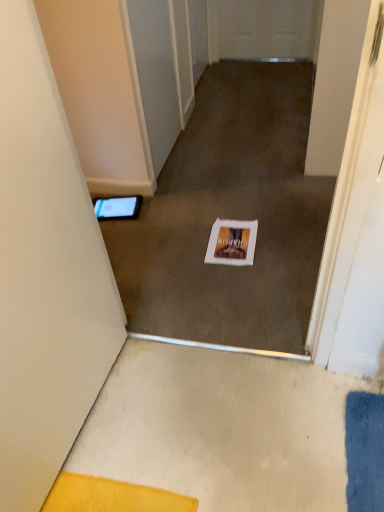
What do you see at coordinates (117, 207) in the screenshot? I see `black glossy tablet at left` at bounding box center [117, 207].

Find the location of a particular element. white paper at center is located at coordinates [232, 242].

Between white matte door at left and white paper at center, which one has less height?

With less height is white paper at center.

Which is more to the left, white matte door at left or white paper at center?

Positioned to the left is white matte door at left.

From a real-world perspective, who is located lower, white matte door at left or white paper at center?

white paper at center is physically lower.

Is white paper at center smaller than black glossy tablet at left?

Yes, white paper at center is smaller than black glossy tablet at left.

Does white paper at center contain black glossy tablet at left?

That's incorrect, black glossy tablet at left is not inside white paper at center.

Does white paper at center turn towards black glossy tablet at left?

No, white paper at center is not turned towards black glossy tablet at left.

Is white paper at center closer to the viewer compared to black glossy tablet at left?

Yes, the depth of white paper at center is less than that of black glossy tablet at left.

From the image's perspective, is black glossy tablet at left over white paper at center?

Correct, black glossy tablet at left appears higher than white paper at center in the image.

Which is in front, black glossy tablet at left or white paper at center?

white paper at center is in front.

In terms of height, does black glossy tablet at left look taller or shorter compared to white paper at center?

black glossy tablet at left is taller than white paper at center.

Which of these two, white matte door at left or black glossy tablet at left, is wider?

With larger width is black glossy tablet at left.

Consider the image. Between white matte door at left and black glossy tablet at left, which one appears on the right side from the viewer's perspective?

Positioned to the right is white matte door at left.

Considering the positions of objects white matte door at left and black glossy tablet at left in the image provided, who is behind, white matte door at left or black glossy tablet at left?

Positioned behind is black glossy tablet at left.

Where is `door below the black glossy tablet at left (from the image's perspective)`? This screenshot has height=512, width=384. door below the black glossy tablet at left (from the image's perspective) is located at coordinates (45, 273).

From the image's perspective, between white paper at center and white matte door at left, who is located below?

white matte door at left appears lower in the image.

From a real-world perspective, is white paper at center above or below white matte door at left?

From a real-world perspective, white paper at center is physically below white matte door at left.

Is white paper at center completely or partially outside of white matte door at left?

Yes, white paper at center is outside of white matte door at left.

This screenshot has width=384, height=512. In order to click on postcard that is behind the white matte door at left in this screenshot , I will do `click(232, 242)`.

Is black glossy tablet at left positioned far away from white matte door at left?

black glossy tablet at left is positioned a significant distance from white matte door at left.

Considering the sizes of objects black glossy tablet at left and white matte door at left in the image provided, who is wider, black glossy tablet at left or white matte door at left?

black glossy tablet at left.

Does point (133, 203) come behind point (21, 104)?

Yes, point (133, 203) is behind point (21, 104).

Find the location of a particular element. This screenshot has width=384, height=512. postcard on the right of white matte door at left is located at coordinates (232, 242).

This screenshot has height=512, width=384. I want to click on postcard below the black glossy tablet at left (from a real-world perspective), so click(x=232, y=242).

Considering their positions, is white matte door at left positioned further to white paper at center than black glossy tablet at left?

white matte door at left is further to white paper at center.

Estimate the real-world distances between objects in this image. Which object is closer to white paper at center, black glossy tablet at left or white matte door at left?

black glossy tablet at left.

From the image, which object appears to be nearer to black glossy tablet at left, white matte door at left or white paper at center?

white paper at center is positioned closer to the anchor black glossy tablet at left.

Looking at the image, which one is located further to black glossy tablet at left, white paper at center or white matte door at left?

white matte door at left is positioned further to the anchor black glossy tablet at left.

When comparing their distances from white matte door at left, does white paper at center or black glossy tablet at left seem further?

black glossy tablet at left lies further to white matte door at left than the other object.

Considering their positions, is black glossy tablet at left positioned closer to white matte door at left than white paper at center?

white paper at center.

Where is `postcard positioned between white matte door at left and black glossy tablet at left from near to far`? The height and width of the screenshot is (512, 384). postcard positioned between white matte door at left and black glossy tablet at left from near to far is located at coordinates (232, 242).